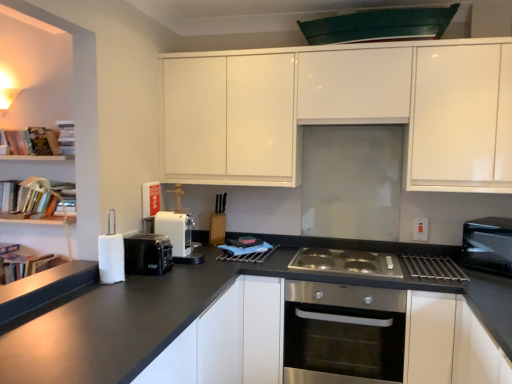
Question: In terms of height, does silver metallic gas stove at center look taller or shorter compared to hardcover books at upper left, the 4th book from the left?

Choices:
 (A) tall
 (B) short

Answer: (B)

Question: Looking at the image, does silver metallic gas stove at center seem bigger or smaller compared to hardcover books at upper left, which ranks as the 1th book in right-to-left order?

Choices:
 (A) small
 (B) big

Answer: (B)

Question: Which object is positioned farthest from the white plastic electric outlet at right?

Choices:
 (A) hardcover book at left, placed as the 4th book when sorted from right to left
 (B) glossy white cabinets at upper center, the 1th cabinetry positioned from the top
 (C) green matte exhaust hood at upper center
 (D) white matte cabinet at center, the second cabinetry when ordered from top to bottom
 (E) black plastic toaster at lower left, the 1th appliance viewed from the front

Answer: (A)

Question: Considering the real-world distances, which object is farthest from the stainless steel oven at center?

Choices:
 (A) glossy white cabinets at upper center, the 2th cabinetry ordered from the bottom
 (B) white plastic coffee machine at center, marked as the second appliance in a front-to-back arrangement
 (C) hardcover book at left, placed as the 4th book when sorted from right to left
 (D) black plastic microwave at right
 (E) hardcover book at left, positioned as the 3th book in right-to-left order

Answer: (C)